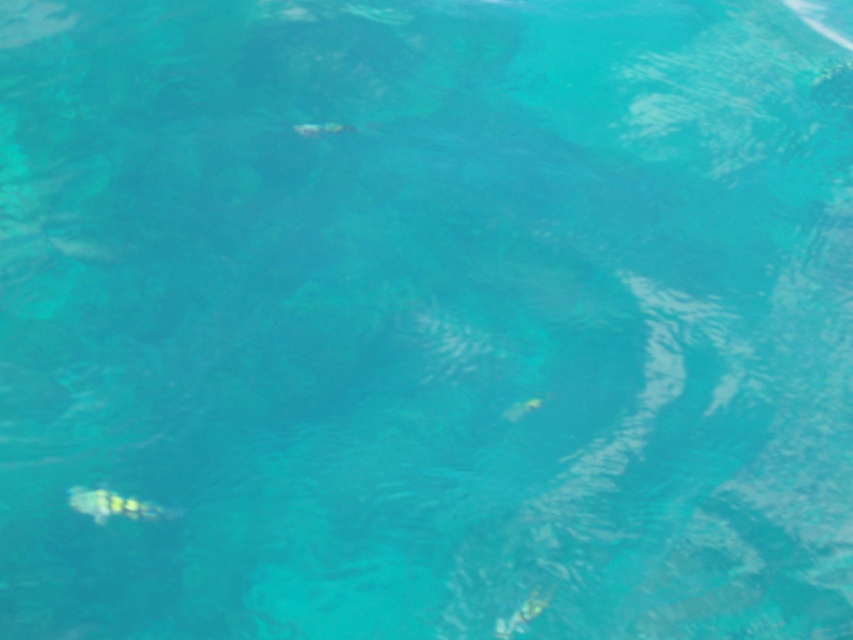
Question: Is translucent yellow fish at bottom left positioned at the back of translucent green fish at center?

Choices:
 (A) no
 (B) yes

Answer: (A)

Question: Which point is closer to the camera taking this photo?

Choices:
 (A) (321, 132)
 (B) (128, 508)

Answer: (B)

Question: Is translucent yellow fish at bottom left to the left of translucent green fish at center from the viewer's perspective?

Choices:
 (A) yes
 (B) no

Answer: (A)

Question: Which of the following is the closest to the observer?

Choices:
 (A) translucent green fish at center
 (B) translucent yellow fish at bottom left

Answer: (B)

Question: Which of the following is the closest to the observer?

Choices:
 (A) translucent green fish at center
 (B) translucent yellow fish at bottom left

Answer: (B)

Question: Can you confirm if translucent yellow fish at bottom left is positioned to the right of translucent green fish at center?

Choices:
 (A) yes
 (B) no

Answer: (B)